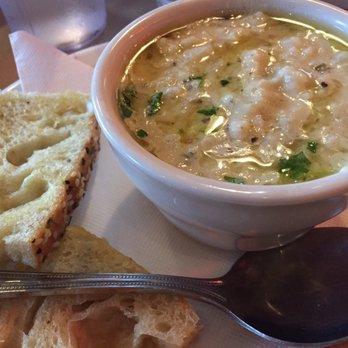
This screenshot has height=348, width=348. Find the location of `glass`. glass is located at coordinates (65, 20).